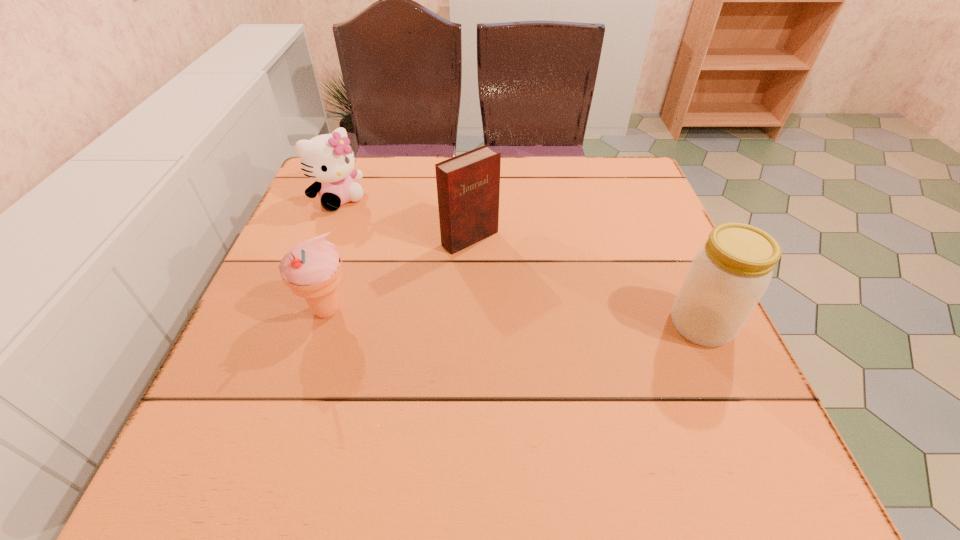
I want to click on icecream, so click(312, 269).

Identify the location of the rightmost object. The height and width of the screenshot is (540, 960). (729, 274).

Identify the location of the farthest object. (328, 159).

You are a GUI agent. You are given a task and a screenshot of the screen. Output one action in this format:
    pyautogui.click(x=<x>, y=<y>)
    Task: Click on the second object from right to left
    The width and height of the screenshot is (960, 540).
    Given the screenshot: What is the action you would take?
    click(468, 185)

I want to click on the second farthest object, so click(x=468, y=185).

At what (x,y) coordinates should I click in order to perform the action: click on blank area located on the back of the icecream. Please return your answer as a coordinate pair (x, y). Image resolution: width=960 pixels, height=540 pixels. Looking at the image, I should click on (344, 257).

The image size is (960, 540). I want to click on vacant space situated on the left of the jar, so click(x=612, y=325).

Locate an element on the screen. This screenshot has height=540, width=960. free region located 0.290m on the front-facing side of the farthest object is located at coordinates (416, 274).

Where is `vacant region located 0.280m on the front-facing side of the farthest object`? Image resolution: width=960 pixels, height=540 pixels. vacant region located 0.280m on the front-facing side of the farthest object is located at coordinates (413, 272).

At what (x,y) coordinates should I click in order to perform the action: click on free spot located on the front-facing side of the farthest object. Please return your answer as a coordinate pair (x, y). Looking at the image, I should click on (398, 257).